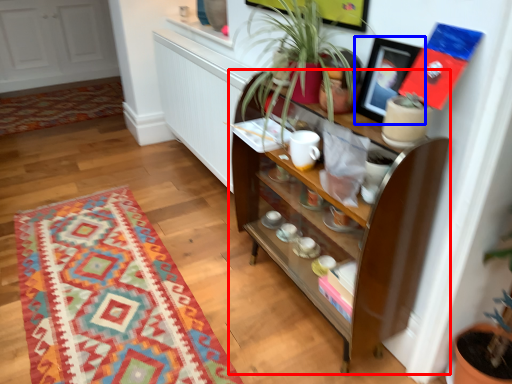
Question: Which object appears farthest to the camera in this image, shelf (highlighted by a red box) or picture frame (highlighted by a blue box)?

Choices:
 (A) shelf
 (B) picture frame

Answer: (B)